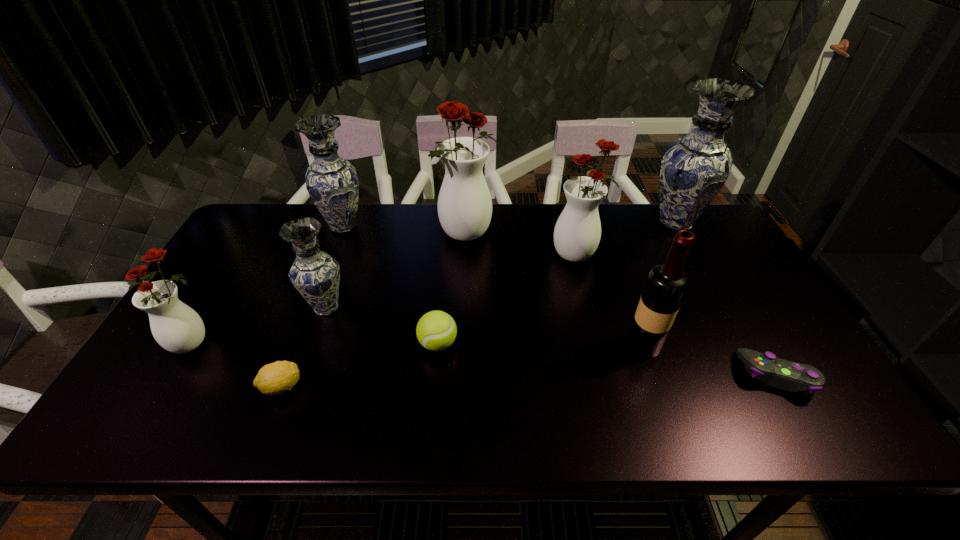
Locate an element on the screen. The height and width of the screenshot is (540, 960). the biggest blue vase is located at coordinates (695, 167).

This screenshot has height=540, width=960. What are the coordinates of `the rightmost blue vase` in the screenshot? It's located at (695, 167).

Find the location of `the second red vase from right to left`. the second red vase from right to left is located at coordinates (464, 206).

This screenshot has height=540, width=960. In order to click on the third vase from right to left in this screenshot , I will do 464,206.

Identify the location of the second smallest blue vase. (332, 183).

Locate an element on the screen. the second biggest red vase is located at coordinates (577, 233).

Identify the location of the rightmost red vase. The height and width of the screenshot is (540, 960). (577, 233).

At what (x,y) coordinates should I click in order to perform the action: click on wine bottle. Please return your answer as a coordinate pair (x, y). This screenshot has width=960, height=540. Looking at the image, I should click on (666, 285).

The width and height of the screenshot is (960, 540). Identify the location of the sixth nearest object. (315, 274).

Image resolution: width=960 pixels, height=540 pixels. Identify the location of the nearest blue vase. (315, 274).